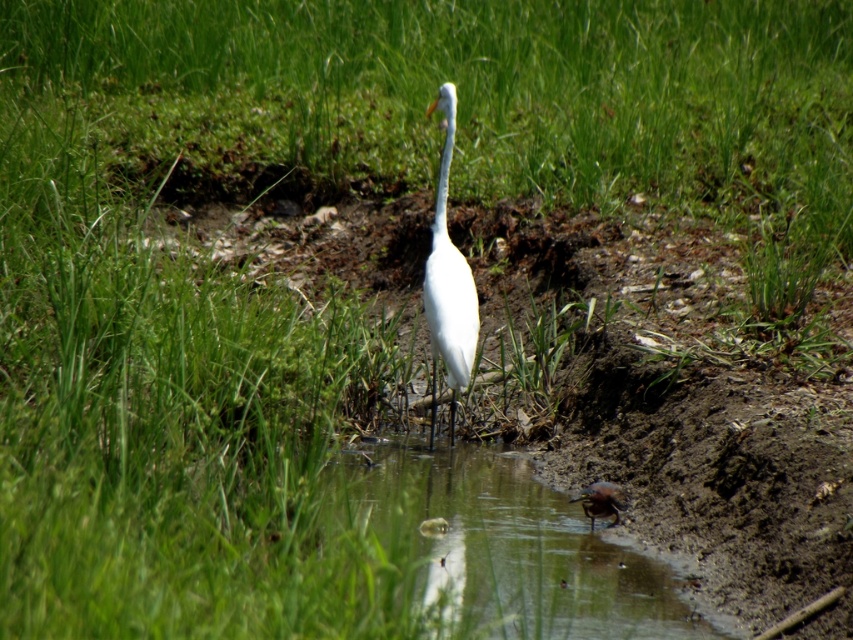
You are a birdwatcher standing at the edge of the wetland. You see the clear water at lower center and the white smooth heron at center. Which object is closer to you?

The clear water at lower center is closer to you because it is in front of the white smooth heron at center.